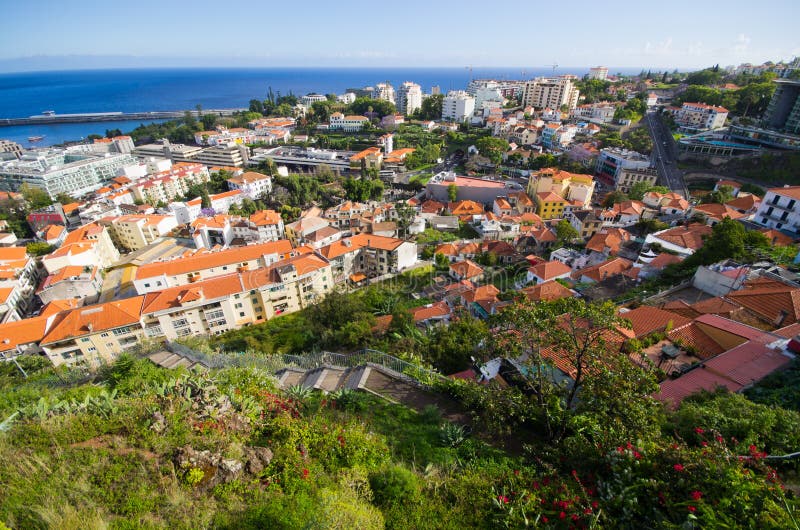
In order to click on flights of stairs in this screenshot , I will do `click(281, 373)`, `click(314, 381)`, `click(194, 368)`, `click(178, 364)`, `click(166, 363)`.